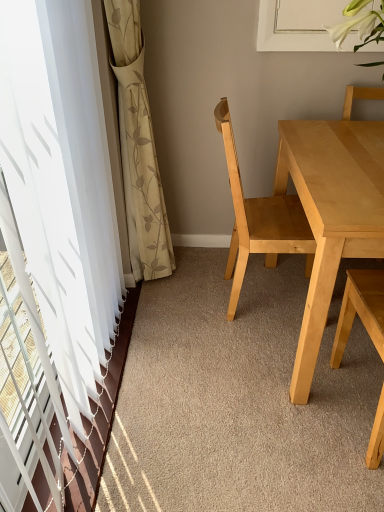
Locate an element on the screen. spots to the right of beige floral fabric curtain at left is located at coordinates (201, 286).